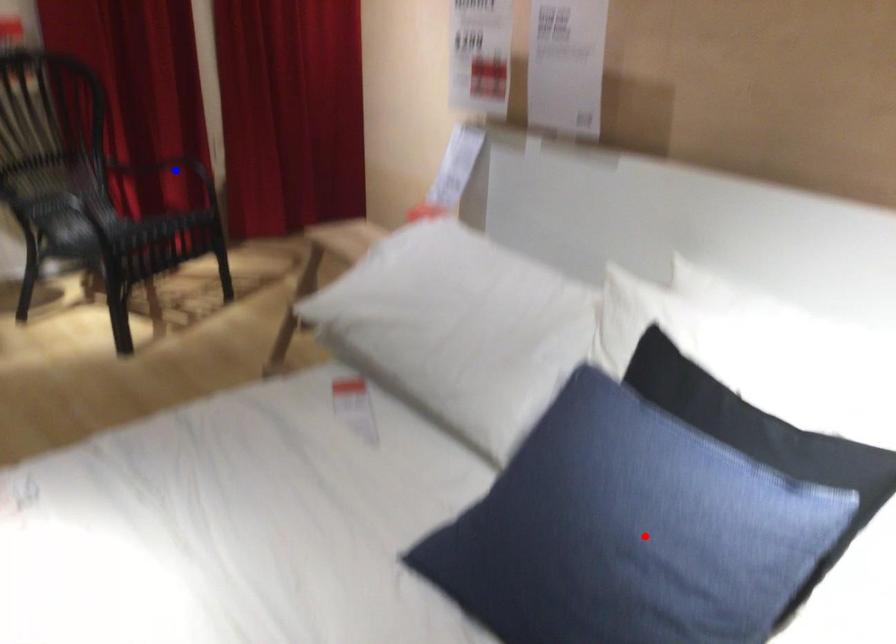
Question: Which of the two points in the image is closer to the camera?

Choices:
 (A) Blue point is closer.
 (B) Red point is closer.

Answer: (B)